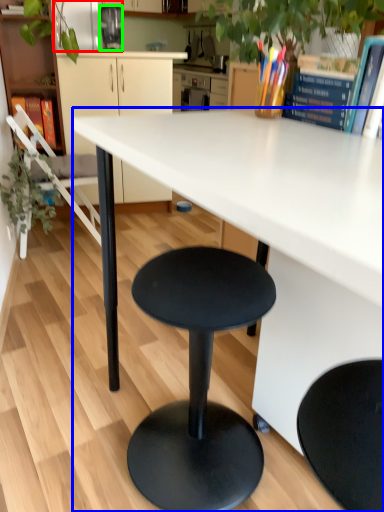
Question: Based on their relative distances, which object is nearer to appliance (highlighted by a red box)? Choose from desk (highlighted by a blue box) and appliance (highlighted by a green box).

Choices:
 (A) desk
 (B) appliance

Answer: (B)